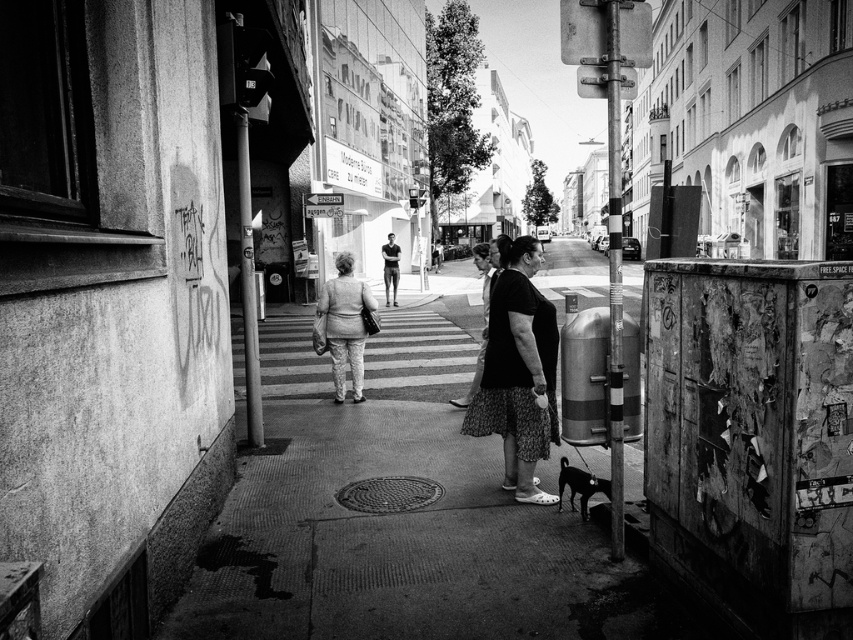
You are a photographer trying to capture two people in the scene. The subjects are wearing a black textured dress at center and a light gray fabric jacket at center. Based on their positions, which clothing item is closer to the right side of the photo?

The black textured dress at center is positioned on the right side of light gray fabric jacket at center, so the black textured dress at center is closer to the right side of the photo.

You are standing on the sidewalk in the urban street scene and want to find the black textured dress at center. According to the coordinates provided, where should you look relative to the textured wall with graffiti?

The black textured dress at center is located at coordinates point [518,371], which means it is positioned to the right and slightly above the textured wall with graffiti.

Based on the photo, in the urban street scene described, there is a point marked at coordinates (518,371). What object or feature does this point correspond to?

The point at coordinates (518,371) corresponds to the black textured dress at center.